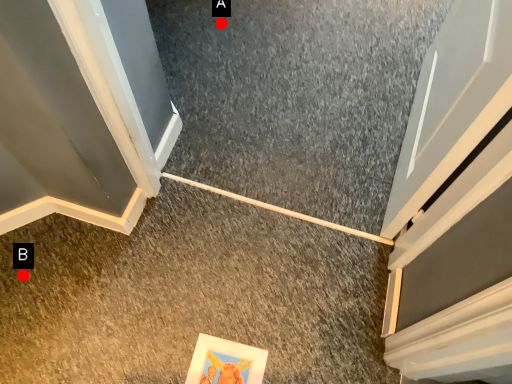
Question: Two points are circled on the image, labeled by A and B beside each circle. Which point is closer to the camera?

Choices:
 (A) A is closer
 (B) B is closer

Answer: (B)